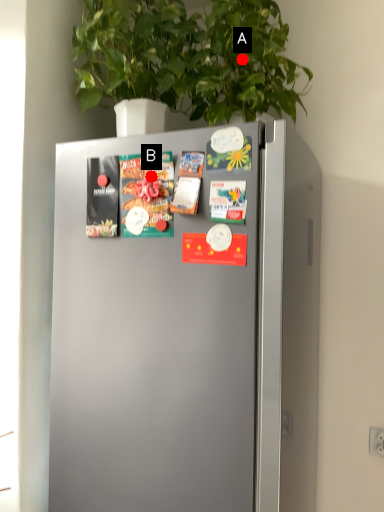
Question: Two points are circled on the image, labeled by A and B beside each circle. Among these points, which one is nearest to the camera?

Choices:
 (A) A is closer
 (B) B is closer

Answer: (B)